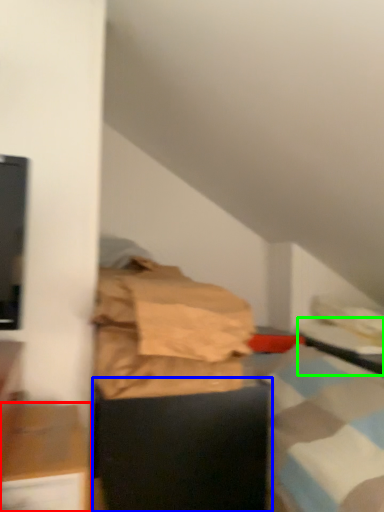
Question: Estimate the real-world distances between objects in this image. Which object is farther from furniture (highlighted by a red box), furniture (highlighted by a blue box) or table (highlighted by a green box)?

Choices:
 (A) furniture
 (B) table

Answer: (B)